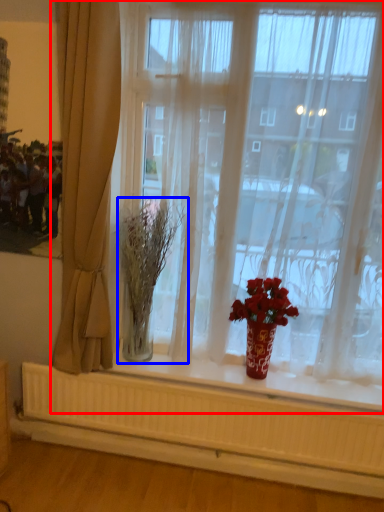
Question: Among these objects, which one is farthest to the camera, window (highlighted by a red box) or plant (highlighted by a blue box)?

Choices:
 (A) window
 (B) plant

Answer: (B)